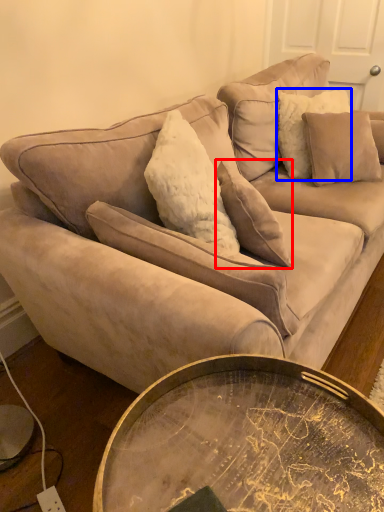
Question: Which object appears closest to the camera in this image, pillow (highlighted by a red box) or pillow (highlighted by a blue box)?

Choices:
 (A) pillow
 (B) pillow

Answer: (A)